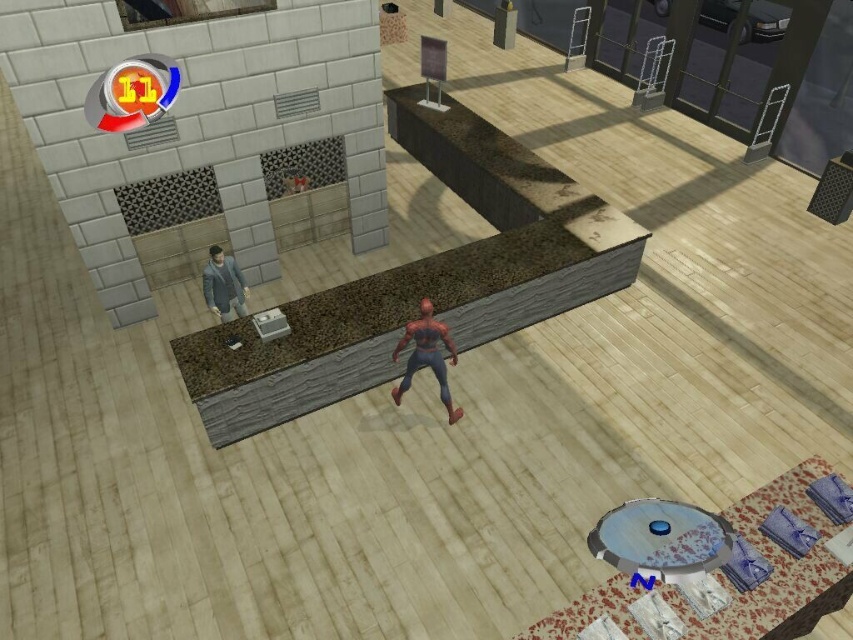
You are navigating a video game level and need to locate the shiny spandex suit at center. According to the game map, what are the coordinates where you can find it?

The shiny spandex suit at center can be found at coordinates point (426,355).

You are a character in the game and need to move from point A to point B. Point A is at coordinate point (398, 394) and point B is at coordinate point (209, 262). Given that the path between them is 1.2 meters wide, can you navigate through it if your character is 0.9 meters wide?

The path between point (398, 394) and point (209, 262) is 1.2 meters wide, so yes, your character can navigate through it since it is wider than the character width of 0.9 meters.

Looking at this image, you are a costume designer observing the scene from Spider Man 2. You need to choose between the shiny spandex suit at center and the smooth gray suit at left for a character. Based on their sizes, which one would require a taller mannequin?

The shiny spandex suit at center requires a taller mannequin because it is taller than the smooth gray suit at left.